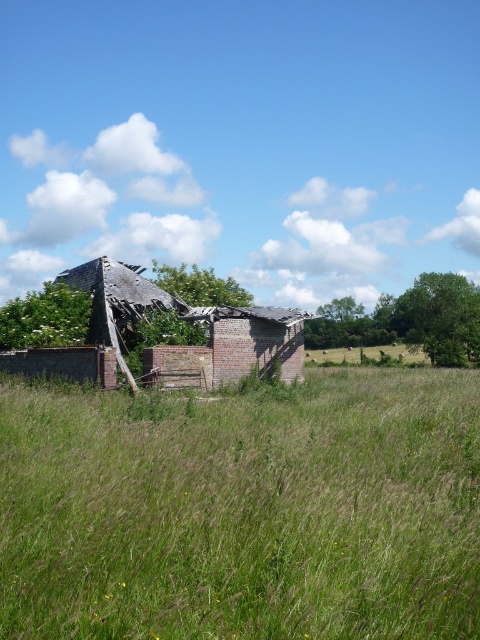
Does green grass at center appear on the left side of brick at center?

No, green grass at center is not to the left of brick at center.

Locate an element on the screen. The width and height of the screenshot is (480, 640). green grass at center is located at coordinates (242, 509).

Between point (410, 445) and point (260, 337), which one is positioned in front?

Point (410, 445) is more forward.

This screenshot has height=640, width=480. In order to click on green grass at center in this screenshot , I will do `click(242, 509)`.